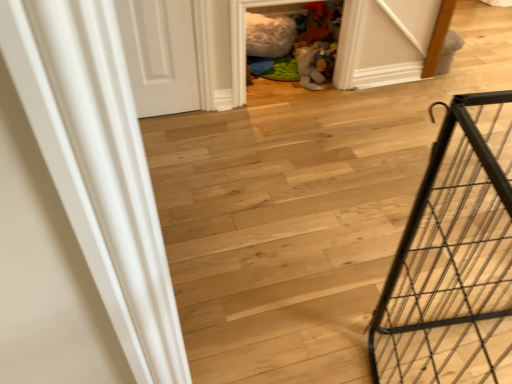
The image size is (512, 384). What do you see at coordinates (454, 258) in the screenshot?
I see `black metal cage at right` at bounding box center [454, 258].

Locate an element on the screen. white matte door at upper left is located at coordinates (160, 55).

From the picture: Measure the distance between wooden floor at center and black metal cage at right.

wooden floor at center is 10.02 inches away from black metal cage at right.

Which of these two, wooden floor at center or black metal cage at right, is smaller?

Smaller between the two is black metal cage at right.

Can you confirm if wooden floor at center is positioned to the right of black metal cage at right?

Yes.

In terms of width, does wooden floor at center look wider or thinner when compared to black metal cage at right?

In the image, wooden floor at center appears to be wider than black metal cage at right.

Is black metal cage at right directly adjacent to wooden floor at center?

They are not placed beside each other.

From a real-world perspective, who is located lower, black metal cage at right or wooden floor at center?

In real-world perspective, wooden floor at center is lower.

Looking at the image, does black metal cage at right seem bigger or smaller compared to wooden floor at center?

Considering their sizes, black metal cage at right takes up less space than wooden floor at center.

Considering their positions, is black metal cage at right located in front of or behind wooden floor at center?

black metal cage at right is positioned closer to the viewer than wooden floor at center.

Can you see wooden floor at center touching white matte door at upper left?

No, wooden floor at center is not making contact with white matte door at upper left.

Is wooden floor at center facing away from white matte door at upper left?

Answer: wooden floor at center does not have its back to white matte door at upper left.

From the image's perspective, which one is positioned higher, wooden floor at center or white matte door at upper left?

From the image's view, white matte door at upper left is above.

Is wooden floor at center surrounded by white matte door at upper left?

No, wooden floor at center is not inside white matte door at upper left.

Does point (135, 39) come closer to viewer compared to point (464, 374)?

No, (135, 39) is behind (464, 374).

Based on their sizes in the image, would you say white matte door at upper left is bigger or smaller than wooden floor at center?

Considering their sizes, white matte door at upper left takes up less space than wooden floor at center.

Is the surface of white matte door at upper left in direct contact with wooden floor at center?

No, white matte door at upper left is not touching wooden floor at center.

Does point (156, 105) appear closer or farther from the camera than point (483, 164)?

Point (156, 105) is farther from the camera than point (483, 164).

Looking at this image, is white matte door at upper left in front of or behind black metal cage at right in the image?

Visually, white matte door at upper left is located behind black metal cage at right.

The height and width of the screenshot is (384, 512). Identify the location of cage located below the white matte door at upper left (from the image's perspective). (454, 258).

Can we say white matte door at upper left lies outside black metal cage at right?

white matte door at upper left lies outside black metal cage at right's area.

Does black metal cage at right have a greater width compared to white matte door at upper left?

Yes.

From the image's perspective, relative to white matte door at upper left, is black metal cage at right above or below?

From the image's perspective, black metal cage at right appears below white matte door at upper left.

How many degrees apart are the facing directions of black metal cage at right and white matte door at upper left?

The angular difference between black metal cage at right and white matte door at upper left is 70.7 degrees.

Find the location of a particular element. This screenshot has height=384, width=512. door that is behind the black metal cage at right is located at coordinates pos(160,55).

Image resolution: width=512 pixels, height=384 pixels. Find the location of `stairwell above the black metal cage at right (from the image's perspective)`. stairwell above the black metal cage at right (from the image's perspective) is located at coordinates (286, 228).

This screenshot has height=384, width=512. I want to click on cage in front of the wooden floor at center, so click(x=454, y=258).

From the image, which object appears to be nearer to white matte door at upper left, black metal cage at right or wooden floor at center?

Based on the image, wooden floor at center appears to be nearer to white matte door at upper left.

From the image, which object appears to be farther from wooden floor at center, black metal cage at right or white matte door at upper left?

white matte door at upper left.

Consider the image. Considering their positions, is wooden floor at center positioned further to black metal cage at right than white matte door at upper left?

The object further to black metal cage at right is white matte door at upper left.

From the image, which object appears to be farther from black metal cage at right, white matte door at upper left or wooden floor at center?

Among the two, white matte door at upper left is located further to black metal cage at right.

Considering their positions, is wooden floor at center positioned closer to white matte door at upper left than black metal cage at right?

Based on the image, wooden floor at center appears to be nearer to white matte door at upper left.

From the image, which object appears to be nearer to wooden floor at center, white matte door at upper left or black metal cage at right?

Among the two, black metal cage at right is located nearer to wooden floor at center.

Where is `stairwell between black metal cage at right and white matte door at upper left along the z-axis`? This screenshot has height=384, width=512. stairwell between black metal cage at right and white matte door at upper left along the z-axis is located at coordinates (286, 228).